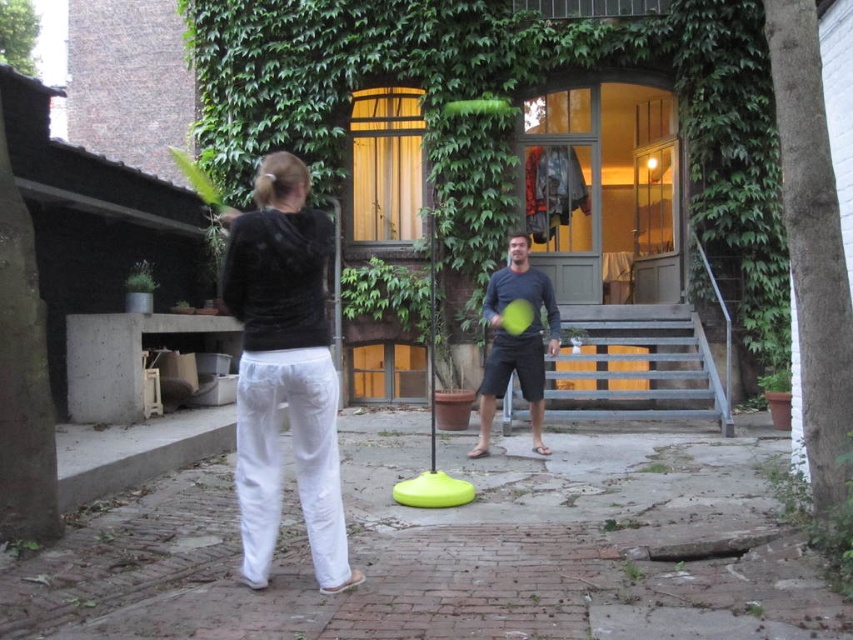
Question: Does velvet black hoodie at center have a larger size compared to dark blue cotton shirt at center?

Choices:
 (A) yes
 (B) no

Answer: (A)

Question: Which point is farther to the camera?

Choices:
 (A) dark blue cotton shirt at center
 (B) velvet black hoodie at center

Answer: (A)

Question: Is velvet black hoodie at center to the left of dark blue cotton shirt at center from the viewer's perspective?

Choices:
 (A) yes
 (B) no

Answer: (A)

Question: Is velvet black hoodie at center bigger than dark blue cotton shirt at center?

Choices:
 (A) yes
 (B) no

Answer: (A)

Question: Among these points, which one is farthest from the camera?

Choices:
 (A) pyautogui.click(x=274, y=378)
 (B) pyautogui.click(x=512, y=369)

Answer: (B)